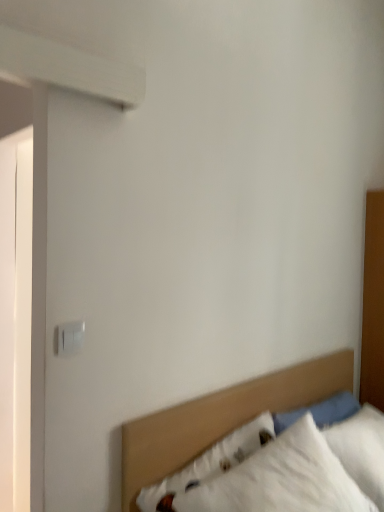
Question: In terms of height, does white plastic switch at upper left look taller or shorter compared to white fabric bed at lower right?

Choices:
 (A) tall
 (B) short

Answer: (B)

Question: Based on their sizes in the image, would you say white plastic switch at upper left is bigger or smaller than white fabric bed at lower right?

Choices:
 (A) big
 (B) small

Answer: (B)

Question: From a real-world perspective, is white plastic switch at upper left positioned above or below white fabric bed at lower right?

Choices:
 (A) below
 (B) above

Answer: (B)

Question: Is white fabric bed at lower right situated inside white plastic switch at upper left or outside?

Choices:
 (A) inside
 (B) outside

Answer: (B)

Question: In terms of width, does white fabric bed at lower right look wider or thinner when compared to white plastic switch at upper left?

Choices:
 (A) wide
 (B) thin

Answer: (A)

Question: From the image's perspective, is white fabric bed at lower right located above or below white plastic switch at upper left?

Choices:
 (A) above
 (B) below

Answer: (B)

Question: In terms of height, does white fabric bed at lower right look taller or shorter compared to white plastic switch at upper left?

Choices:
 (A) short
 (B) tall

Answer: (B)